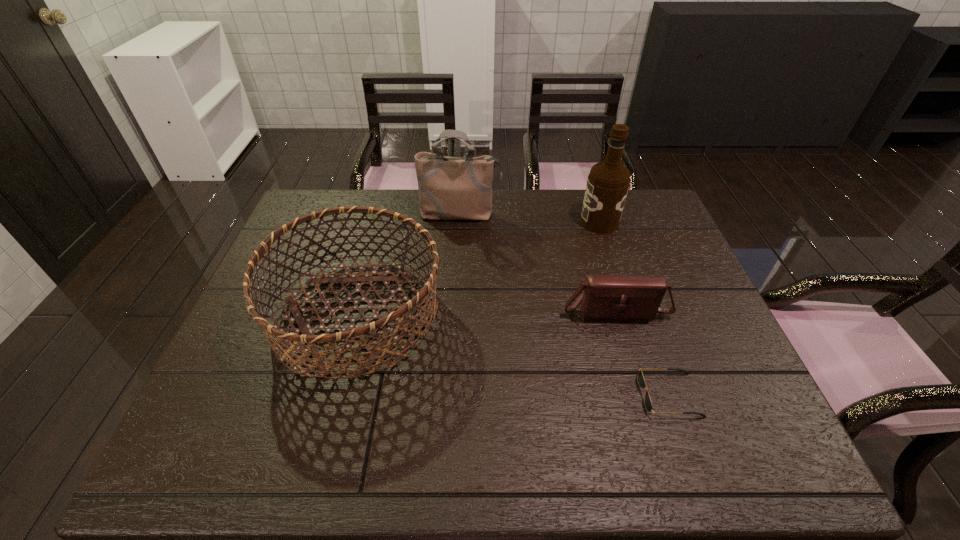
The image size is (960, 540). I want to click on empty location between the farther shoulder bag and the shortest object, so click(x=564, y=305).

I want to click on unoccupied position between the basket and the right shoulder bag, so click(x=487, y=313).

Identify the location of unoccupied position between the third tallest object and the alcohol. The image size is (960, 540). (479, 269).

Image resolution: width=960 pixels, height=540 pixels. Find the location of `free space between the sunglasses and the taller shoulder bag`. free space between the sunglasses and the taller shoulder bag is located at coordinates (564, 305).

In order to click on free spot between the right shoulder bag and the shortest object in this screenshot , I will do `click(642, 352)`.

You are a GUI agent. You are given a task and a screenshot of the screen. Output one action in this format:
    pyautogui.click(x=<x>, y=<y>)
    Task: Click on the free point between the farther shoulder bag and the alcohol
    
    Given the screenshot: What is the action you would take?
    pyautogui.click(x=530, y=218)

Identify which object is located as the second nearest to the basket. Please provide its 2D coordinates. Your answer should be formatted as a tuple, i.e. [(x, y)], where the tuple contains the x and y coordinates of a point satisfying the conditions above.

[(638, 297)]

Locate which object is the fourth closest to the sunglasses. Please provide its 2D coordinates. Your answer should be formatted as a tuple, i.e. [(x, y)], where the tuple contains the x and y coordinates of a point satisfying the conditions above.

[(450, 188)]